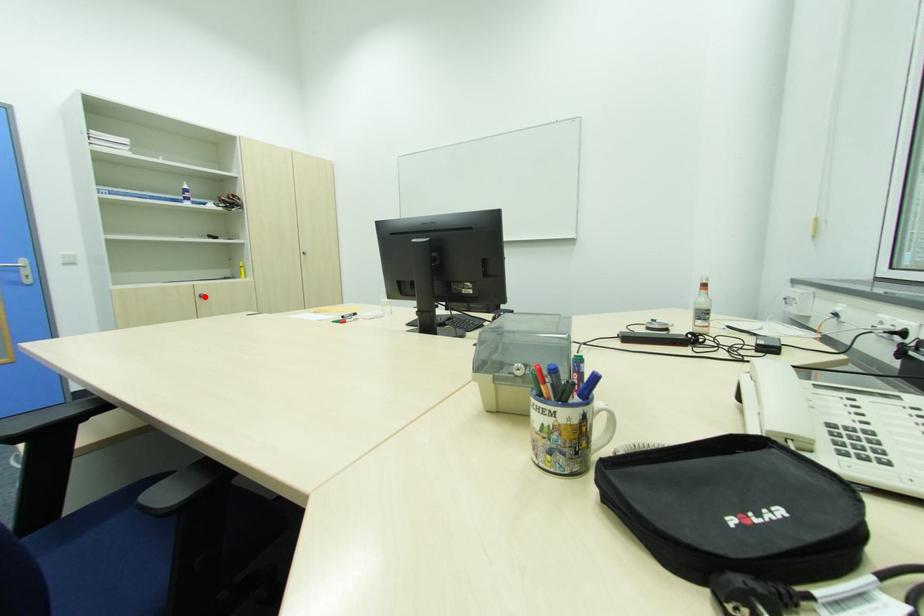
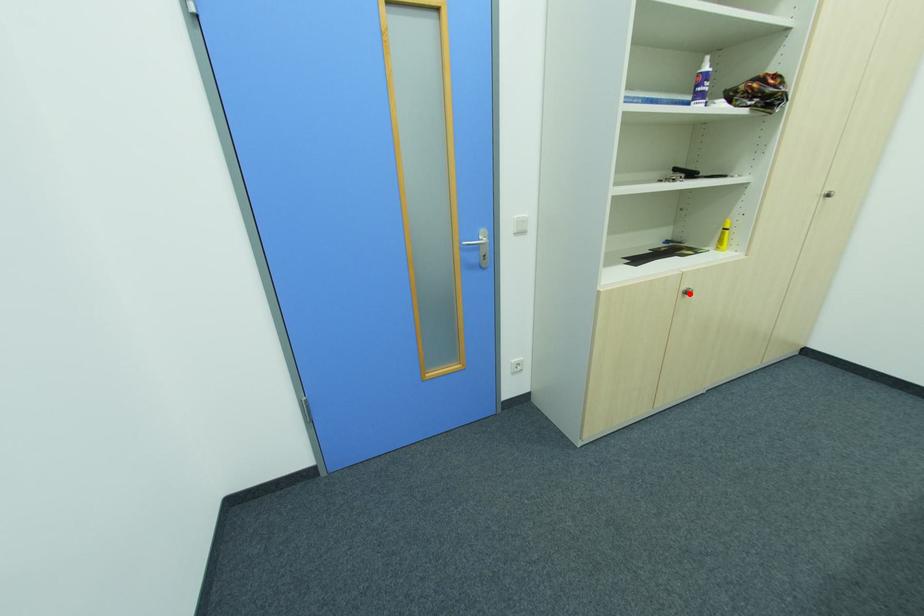
Based on the photo, I am providing you with two images of the same scene from different viewpoints. A red point is marked on the first image and another point is marked on the second image. Is the red point in image1 aligned with the point shown in image2?

Yes